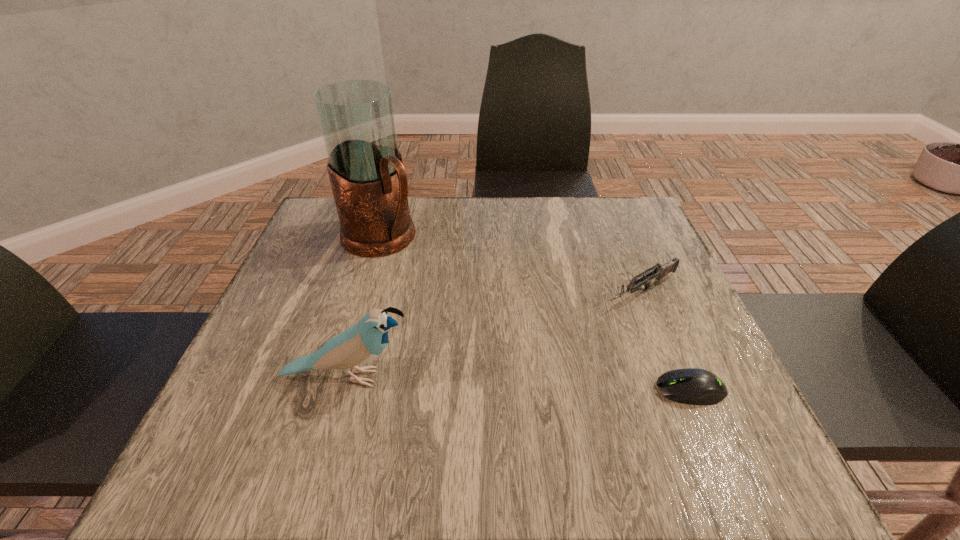
Locate an element on the screen. vacant area that lies between the bird and the shortest object is located at coordinates (518, 383).

This screenshot has width=960, height=540. What are the coordinates of `free area in between the computer mouse and the bird` in the screenshot? It's located at (518, 383).

Locate an element on the screen. The image size is (960, 540). unoccupied position between the tallest object and the bird is located at coordinates (364, 308).

Locate an element on the screen. unoccupied position between the tallest object and the bird is located at coordinates (364, 308).

Where is `blank region between the tallest object and the third tallest object`? The height and width of the screenshot is (540, 960). blank region between the tallest object and the third tallest object is located at coordinates (511, 266).

I want to click on unoccupied area between the shortest object and the bird, so click(x=518, y=383).

You are a GUI agent. You are given a task and a screenshot of the screen. Output one action in this format:
    pyautogui.click(x=<x>, y=<y>)
    Task: Click on the empty space that is in between the farthest object and the gun
    The height and width of the screenshot is (540, 960).
    Given the screenshot: What is the action you would take?
    pyautogui.click(x=511, y=266)

You are a GUI agent. You are given a task and a screenshot of the screen. Output one action in this format:
    pyautogui.click(x=<x>, y=<y>)
    Task: Click on the empty location between the computer mouse and the bird
    The width and height of the screenshot is (960, 540).
    Given the screenshot: What is the action you would take?
    pyautogui.click(x=518, y=383)

Locate an element on the screen. unoccupied area between the second shortest object and the farthest object is located at coordinates (511, 266).

This screenshot has height=540, width=960. I want to click on empty space between the shortest object and the tallest object, so [536, 314].